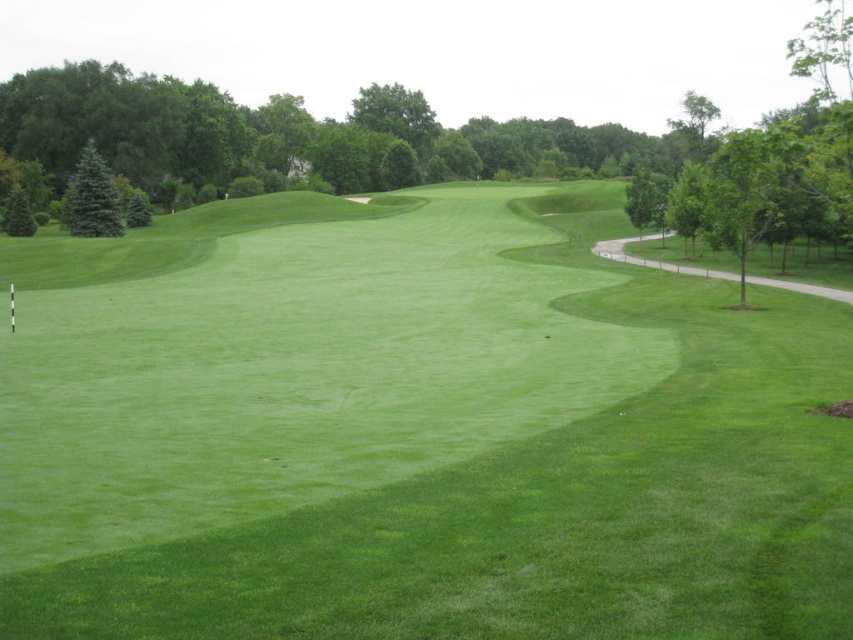
Question: Which object is positioned farthest from the green leafy tree at left?

Choices:
 (A) blue-green needle-like tree at upper left
 (B) green smooth grass at center

Answer: (B)

Question: Can you confirm if green smooth grass at center is positioned to the left of green leafy tree at left?

Choices:
 (A) yes
 (B) no

Answer: (B)

Question: Which object is closer to the camera taking this photo?

Choices:
 (A) green leafy tree at left
 (B) green smooth grass at center
 (C) blue-green needle-like tree at upper left

Answer: (B)

Question: Can you confirm if green smooth grass at center is positioned to the left of blue-green needle-like tree at upper left?

Choices:
 (A) no
 (B) yes

Answer: (A)

Question: In this image, where is green smooth grass at center located relative to blue-green needle-like tree at upper left?

Choices:
 (A) left
 (B) right

Answer: (B)

Question: Which is nearer to the green smooth grass at center?

Choices:
 (A) green leafy tree at left
 (B) blue-green needle-like tree at upper left

Answer: (A)